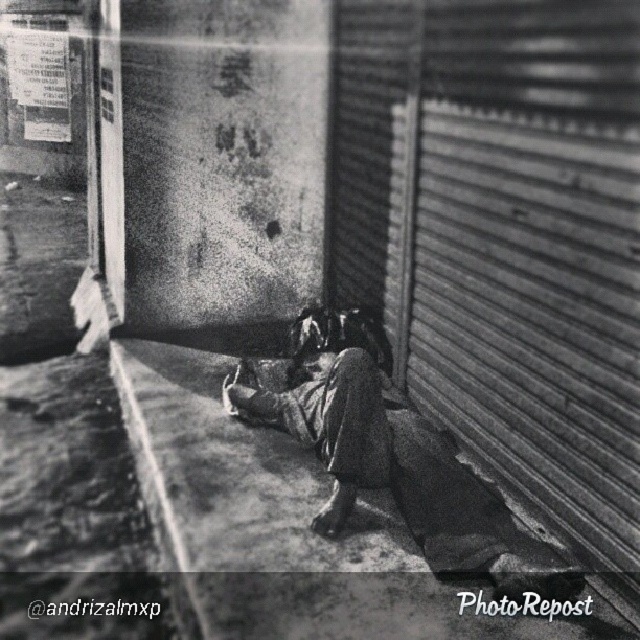
Question: Among these objects, which one is farthest from the camera?

Choices:
 (A) smooth concrete curb at lower left
 (B) metallic corrugated at right

Answer: (A)

Question: From the image, what is the correct spatial relationship of metallic corrugated at right in relation to smooth concrete curb at lower left?

Choices:
 (A) below
 (B) above

Answer: (B)

Question: Which point is farther to the camera?

Choices:
 (A) ragged fabric woman at center
 (B) metallic corrugated at right

Answer: (A)

Question: Which object is the closest to the ragged fabric woman at center?

Choices:
 (A) metallic corrugated at right
 (B) smooth concrete curb at lower left

Answer: (A)

Question: From the image, what is the correct spatial relationship of metallic corrugated at right in relation to ragged fabric woman at center?

Choices:
 (A) right
 (B) left

Answer: (A)

Question: Is ragged fabric woman at center wider than smooth concrete curb at lower left?

Choices:
 (A) no
 (B) yes

Answer: (B)